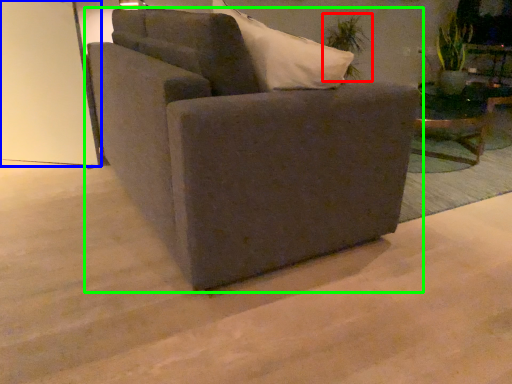
Question: Which is nearer to the plant (highlighted by a red box)? glass door (highlighted by a blue box) or chair (highlighted by a green box).

Choices:
 (A) glass door
 (B) chair

Answer: (A)